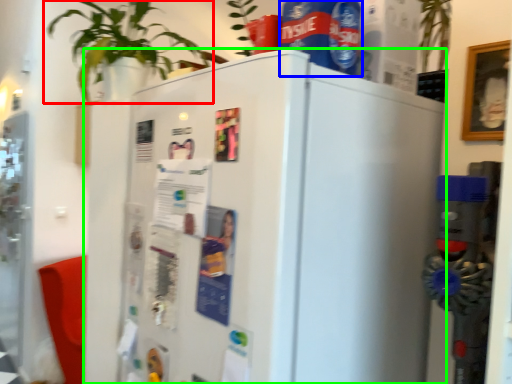
Question: Estimate the real-world distances between objects in this image. Which object is farther from houseplant (highlighted by a red box), beverage (highlighted by a blue box) or refrigerator (highlighted by a green box)?

Choices:
 (A) beverage
 (B) refrigerator

Answer: (A)